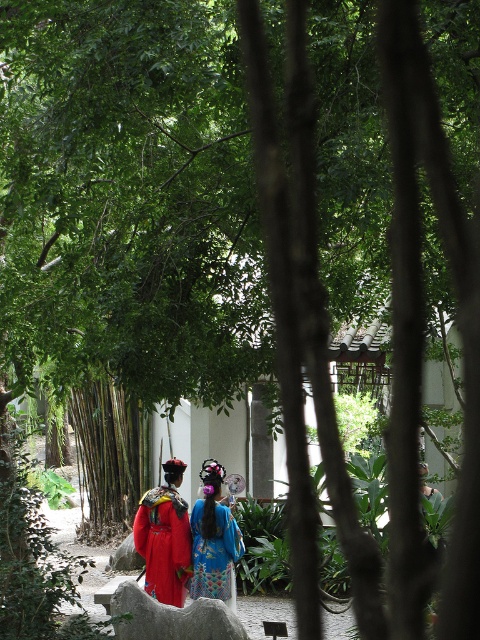
Question: Observing the image, what is the correct spatial positioning of green bamboo forest at center in reference to red satin robe at center?

Choices:
 (A) below
 (B) above

Answer: (A)

Question: Which object is positioned closest to the red satin robe at center?

Choices:
 (A) green bamboo forest at center
 (B) blue silk dress at center

Answer: (B)

Question: Which object appears farthest from the camera in this image?

Choices:
 (A) green bamboo forest at center
 (B) red satin robe at center

Answer: (A)

Question: Does green bamboo forest at center have a larger size compared to red satin robe at center?

Choices:
 (A) no
 (B) yes

Answer: (A)

Question: Which point is closer to the camera?

Choices:
 (A) (112, 400)
 (B) (204, 492)

Answer: (B)

Question: Can you confirm if green bamboo forest at center is wider than red satin robe at center?

Choices:
 (A) yes
 (B) no

Answer: (B)